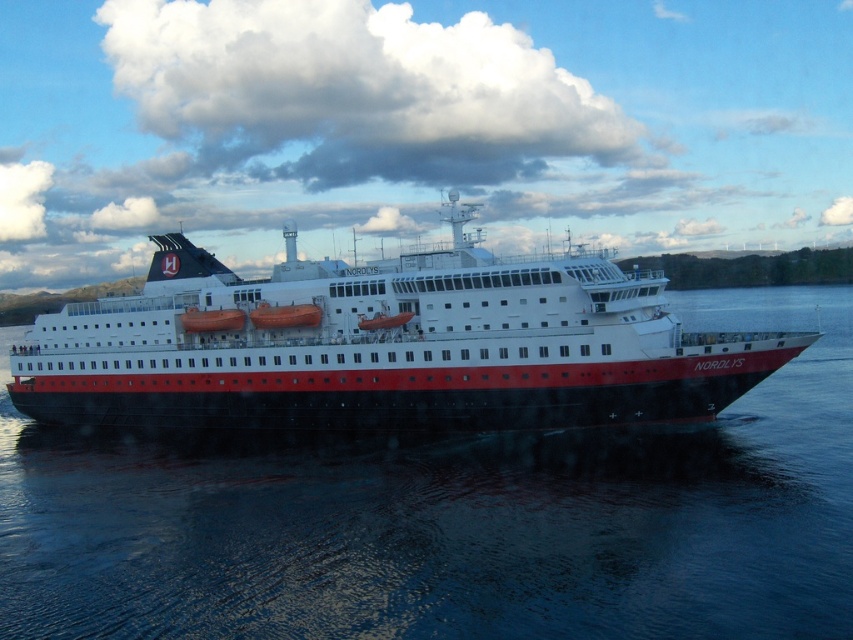
Who is positioned more to the left, black water at center or polished steel ship at center?

From the viewer's perspective, polished steel ship at center appears more on the left side.

Who is taller, black water at center or polished steel ship at center?

polished steel ship at center

Is point (850, 355) in front of point (689, 346)?

No.

I want to click on black water at center, so click(x=454, y=518).